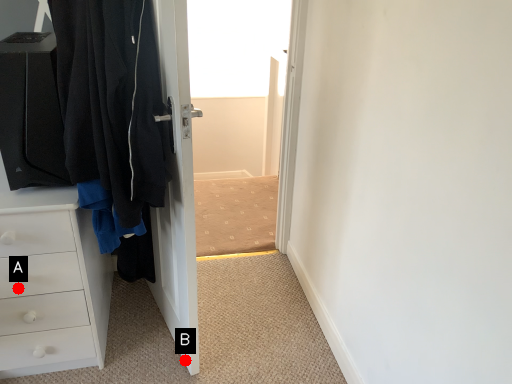
Question: Two points are circled on the image, labeled by A and B beside each circle. Which point is farther to the camera?

Choices:
 (A) A is further
 (B) B is further

Answer: (B)